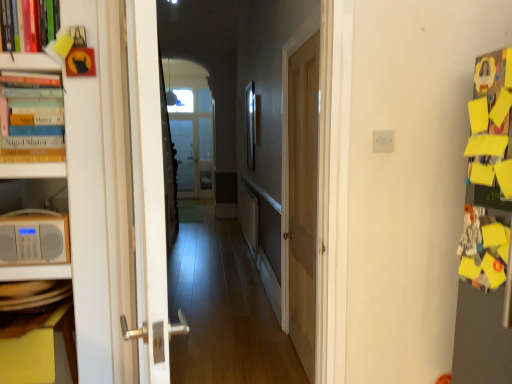
The image size is (512, 384). Find the location of `matte white radio at left`. matte white radio at left is located at coordinates (34, 238).

Based on the photo, measure the distance between metallic silver picture frame at center and camera.

They are 15.94 feet apart.

I want to click on wooden floor at center, so click(x=240, y=89).

In order to click on white plastic electric outlet at center in this screenshot , I will do `click(383, 141)`.

What is the approximate width of white plastic electric outlet at center?

0.48 inches.

Where is `matte white radio at left`? matte white radio at left is located at coordinates (34, 238).

Between hardcover books at left and white glossy door at left, marked as the second door in a right-to-left arrangement, which one has smaller width?

Thinner between the two is hardcover books at left.

Is hardcover books at left far from white glossy door at left, placed as the 2th door when sorted from back to front?

No, hardcover books at left is not far away from white glossy door at left, placed as the 2th door when sorted from back to front.

Is hardcover books at left oriented away from white glossy door at left, the 1th door from the left?

No, hardcover books at left is not facing the opposite direction of white glossy door at left, the 1th door from the left.

From a real-world perspective, is hardcover books at left under white glossy door at left, the 1th door from the left?

No.

Is point (250, 134) positioned before point (138, 81)?

No, it is not.

Is metallic silver picture frame at center bigger than white glossy door at left, placed as the 2th door when sorted from back to front?

No, metallic silver picture frame at center is not bigger than white glossy door at left, placed as the 2th door when sorted from back to front.

Considering the positions of objects metallic silver picture frame at center and white glossy door at left, marked as the second door in a right-to-left arrangement, in the image provided, who is more to the right, metallic silver picture frame at center or white glossy door at left, marked as the second door in a right-to-left arrangement,?

From the viewer's perspective, metallic silver picture frame at center appears more on the right side.

Is metallic silver picture frame at center oriented towards white glossy door at left, acting as the 1th door starting from the front?

No, metallic silver picture frame at center does not turn towards white glossy door at left, acting as the 1th door starting from the front.

Looking at this image, which is nearer, (51, 120) or (376, 149)?

The point (51, 120) is more forward.

Considering the relative sizes of hardcover books at left and white plastic electric outlet at center in the image provided, is hardcover books at left taller than white plastic electric outlet at center?

Yes.

Based on their sizes in the image, would you say hardcover books at left is bigger or smaller than white plastic electric outlet at center?

Clearly, hardcover books at left is larger in size than white plastic electric outlet at center.

Can you tell me how much hardcover books at left and white plastic electric outlet at center differ in facing direction?

They differ by 0.00624 degrees in their facing directions.

How many degrees apart are the facing directions of wooden door at center, the second door positioned from the left, and white plastic electric outlet at center?

91.1 degrees.

Is wooden door at center, marked as the first door in a back-to-front arrangement, behind white plastic electric outlet at center?

Yes, wooden door at center, marked as the first door in a back-to-front arrangement, is further from the camera.

Locate an element on the screen. This screenshot has height=384, width=512. electric outlet on the right of wooden door at center, the second door positioned from the left is located at coordinates (383, 141).

From a real-world perspective, is wooden door at center, marked as the 2th door in a front-to-back arrangement, located beneath white plastic electric outlet at center?

Yes.

Which is behind, wooden floor at center or hardcover books at left?

hardcover books at left is further away from the camera.

Measure the distance from wooden floor at center to hardcover books at left.

They are 4.30 meters apart.

Is there a large distance between wooden floor at center and hardcover books at left?

That's right, there is a large distance between wooden floor at center and hardcover books at left.

Which is closer, [232,157] or [55,116]?

Positioned in front is point [55,116].

Which of these two, wooden door at center, marked as the 2th door in a front-to-back arrangement, or matte white radio at left, stands taller?

Standing taller between the two is wooden door at center, marked as the 2th door in a front-to-back arrangement.

How many degrees apart are the facing directions of wooden door at center, marked as the 2th door in a front-to-back arrangement, and matte white radio at left?

The angular difference between wooden door at center, marked as the 2th door in a front-to-back arrangement, and matte white radio at left is 92.1 degrees.

From the image's perspective, which one is positioned lower, wooden door at center, positioned as the first door in right-to-left order, or matte white radio at left?

From the image's view, matte white radio at left is below.

Does point (300, 68) appear closer or farther from the camera than point (46, 236)?

Point (300, 68) is positioned farther from the camera compared to point (46, 236).

From a real-world perspective, is white plastic electric outlet at center physically below matte white radio at left?

Actually, white plastic electric outlet at center is physically above matte white radio at left in the real world.

Who is taller, white plastic electric outlet at center or matte white radio at left?

matte white radio at left is taller.

Is white plastic electric outlet at center placed right next to matte white radio at left?

No, white plastic electric outlet at center is not in contact with matte white radio at left.

The height and width of the screenshot is (384, 512). What are the coordinates of `door that is the 1st object to the right of the hardcover books at left, starting at the anchor` in the screenshot? It's located at (148, 193).

Locate an element on the screen. The width and height of the screenshot is (512, 384). door that is the 1st object located below the metallic silver picture frame at center (from the image's perspective) is located at coordinates (148, 193).

Based on their spatial positions, is matte white radio at left or white plastic electric outlet at center closer to metallic silver picture frame at center?

white plastic electric outlet at center is closer to metallic silver picture frame at center.

Which object lies further to the anchor point wooden door at center, the second door positioned from the left, hardcover books at left or matte white radio at left?

matte white radio at left is further to wooden door at center, the second door positioned from the left.

Looking at the image, which one is located further to white plastic electric outlet at center, hardcover books at left or white glossy door at left, acting as the 1th door starting from the front?

The object further to white plastic electric outlet at center is hardcover books at left.

Estimate the real-world distances between objects in this image. Which object is further from wooden floor at center, hardcover books at left or wooden door at center, marked as the first door in a back-to-front arrangement?

hardcover books at left is further to wooden floor at center.

Looking at the image, which one is located further to hardcover books at left, matte white radio at left or wooden floor at center?

wooden floor at center is positioned further to the anchor hardcover books at left.

Looking at this image, looking at the image, which one is located closer to metallic silver picture frame at center, matte white radio at left or white glossy door at left, acting as the 1th door starting from the front?

The object closer to metallic silver picture frame at center is matte white radio at left.

Which object lies nearer to the anchor point metallic silver picture frame at center, wooden door at center, marked as the 2th door in a front-to-back arrangement, or white plastic electric outlet at center?

wooden door at center, marked as the 2th door in a front-to-back arrangement, is positioned closer to the anchor metallic silver picture frame at center.

Based on their spatial positions, is white plastic electric outlet at center or matte white radio at left further from hardcover books at left?

white plastic electric outlet at center lies further to hardcover books at left than the other object.

Identify the location of electric outlet positioned between wooden floor at center and metallic silver picture frame at center from near to far. (383, 141).

At what (x,y) coordinates should I click in order to perform the action: click on door between hardcover books at left and metallic silver picture frame at center from front to back. Please return your answer as a coordinate pair (x, y). Looking at the image, I should click on (303, 198).

Locate an element on the screen. corridor between white glossy door at left, placed as the 2th door when sorted from back to front, and metallic silver picture frame at center, along the z-axis is located at coordinates (240, 89).

Where is `book located between white glossy door at left, the 1th door from the left, and wooden door at center, marked as the first door in a back-to-front arrangement, in the depth direction`? This screenshot has width=512, height=384. book located between white glossy door at left, the 1th door from the left, and wooden door at center, marked as the first door in a back-to-front arrangement, in the depth direction is located at coordinates (31, 117).